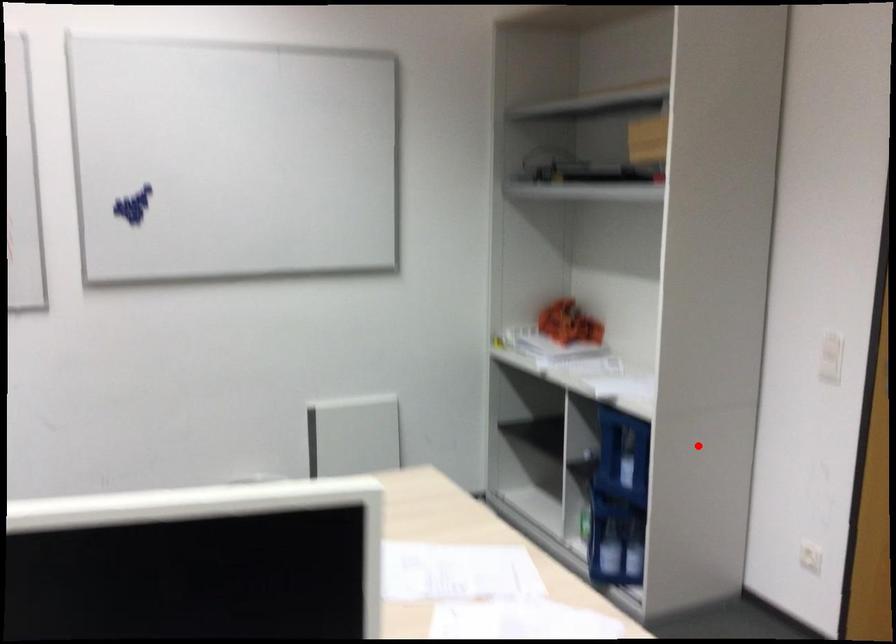
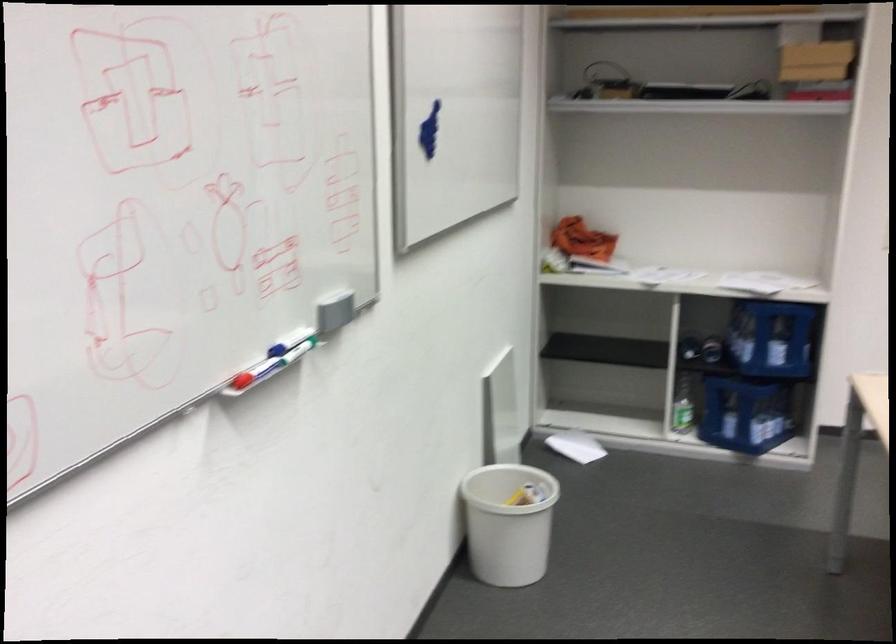
Question: A red point is marked in image1. In image2, is the corresponding 3D point closer to the camera or farther? Reply with the corresponding letter.

Choices:
 (A) The corresponding 3D point is closer.
 (B) The corresponding 3D point is farther.

Answer: (B)